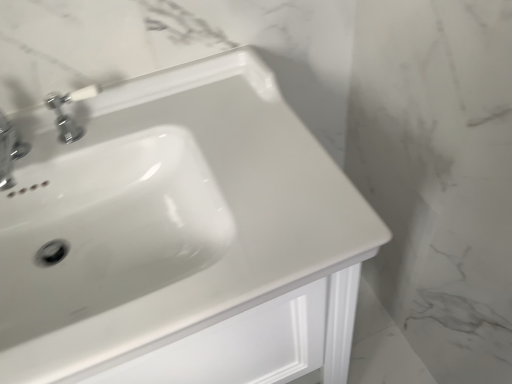
Question: Is white glossy sink at center wider or thinner than chrome metallic faucet at upper left, which is the 1th tap from left to right?

Choices:
 (A) thin
 (B) wide

Answer: (B)

Question: From the image's perspective, is white glossy sink at center located above or below chrome metallic faucet at upper left, which is the 1th tap from left to right?

Choices:
 (A) below
 (B) above

Answer: (A)

Question: Estimate the real-world distances between objects in this image. Which object is closer to the chrome metallic faucet at upper left, the first tap when ordered from right to left?

Choices:
 (A) chrome metallic faucet at upper left, placed as the second tap when sorted from right to left
 (B) white glossy sink at center

Answer: (A)

Question: Considering the real-world distances, which object is closest to the chrome metallic faucet at upper left, placed as the second tap when sorted from right to left?

Choices:
 (A) chrome metallic faucet at upper left, the first tap when ordered from right to left
 (B) white glossy sink at center

Answer: (A)